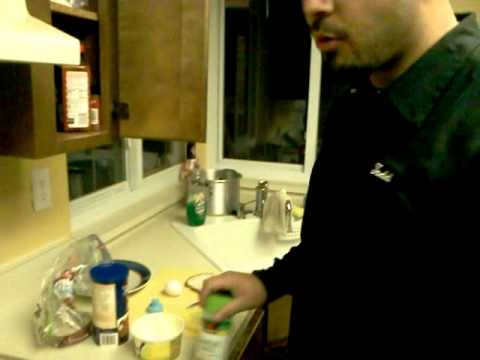
You are a GUI agent. You are given a task and a screenshot of the screen. Output one action in this format:
    pyautogui.click(x=<x>, y=<y>)
    Task: Click on the rag
    This screenshot has height=360, width=480.
    Given the screenshot: What is the action you would take?
    pyautogui.click(x=274, y=214)